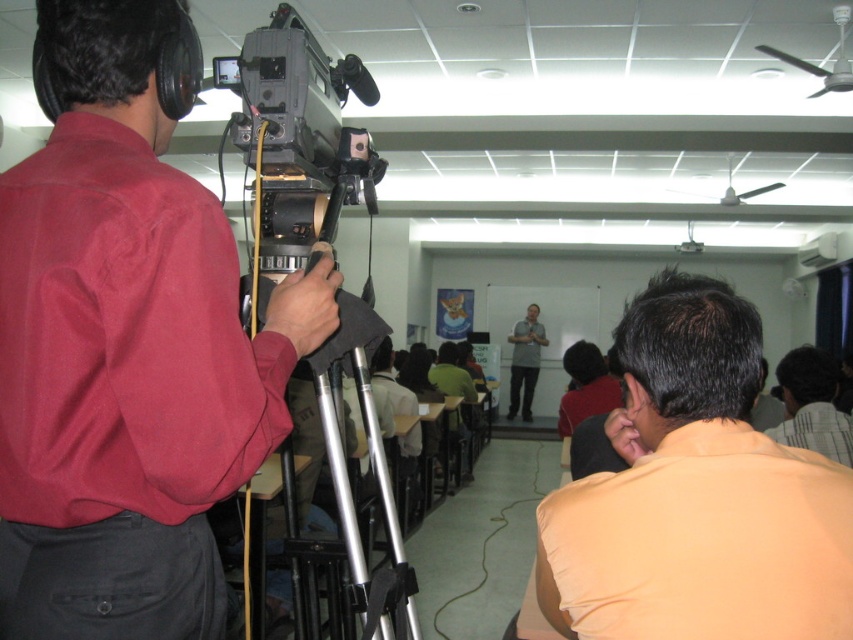
You are sitting in the classroom and want to wave to both the striped shirt at lower right and the gray fabric shirt at center. Which one should you look to your right to wave at?

The striped shirt at lower right is to the right of the gray fabric shirt at center, so you should look to your right to wave at the striped shirt at lower right.

You are sitting in the classroom and want to take a photo of the orange matte shirt at lower right and the silver metallic tripod at center. Which object is shorter?

The orange matte shirt at lower right is not as tall as the silver metallic tripod at center, so the orange matte shirt at lower right is shorter.

You are sitting in the classroom and want to take a photo of the striped shirt at lower right and the gray fabric shirt at center. Which one would appear larger in your photo?

The striped shirt at lower right would appear larger in the photo because it is closer to the viewer than the gray fabric shirt at center.